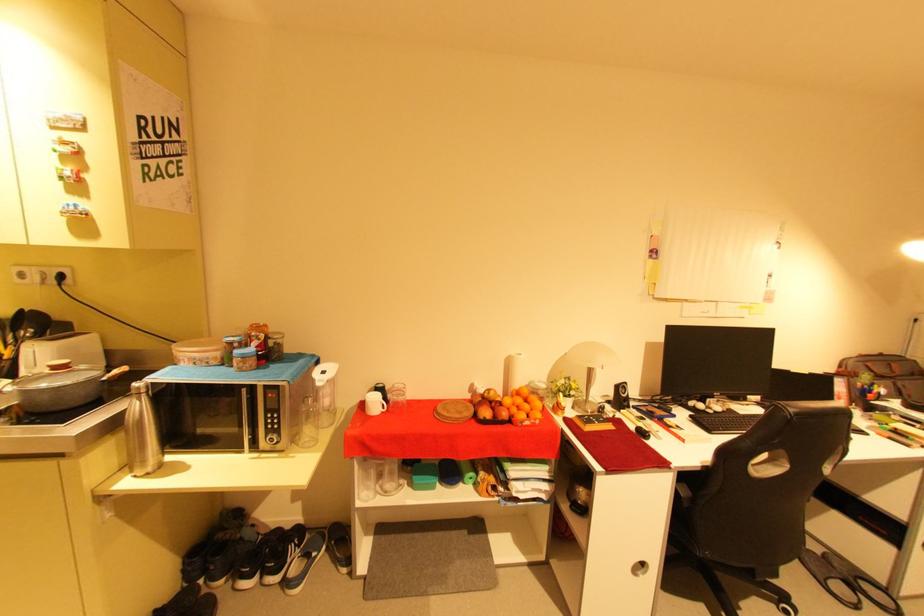
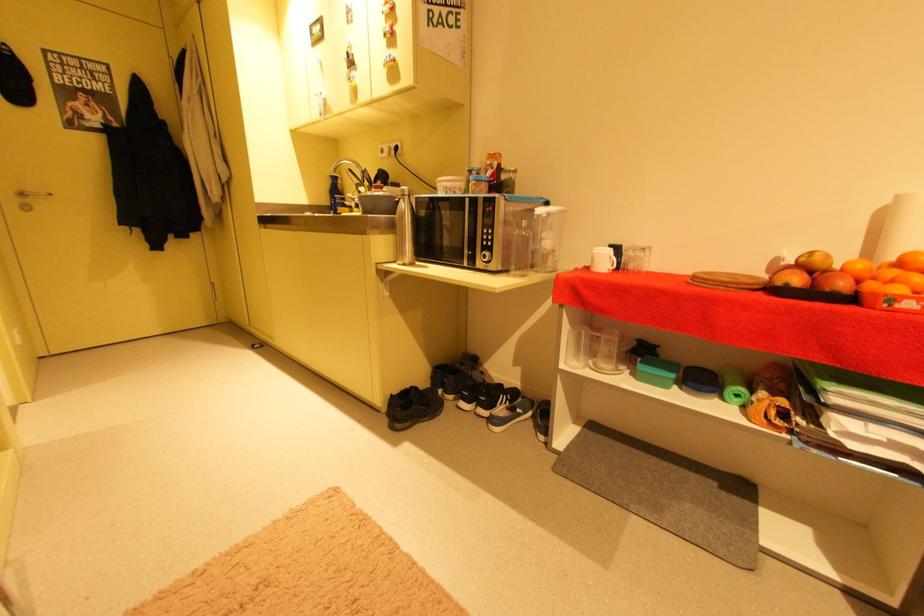
Question: The camera is either moving clockwise (left) or counter-clockwise (right) around the object. The first image is from the beginning of the video and the second image is from the end. Is the camera moving left or right when shooting the video?

Choices:
 (A) Left
 (B) Right

Answer: (B)